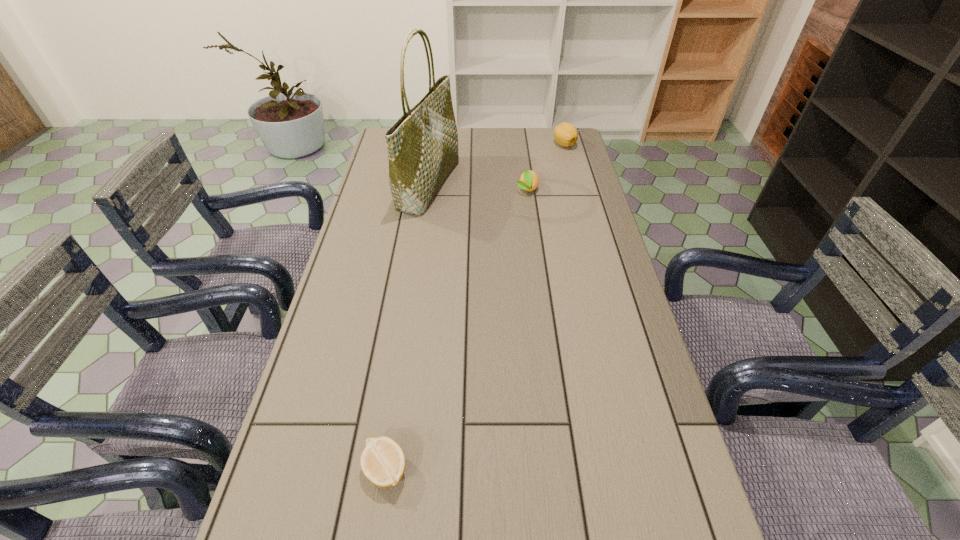
Where is `the third closest object to the leftmost lemon`? This screenshot has height=540, width=960. the third closest object to the leftmost lemon is located at coordinates (565, 134).

Identify which object is the third nearest to the shortest lemon. Please provide its 2D coordinates. Your answer should be formatted as a tuple, i.e. [(x, y)], where the tuple contains the x and y coordinates of a point satisfying the conditions above.

[(565, 134)]

At what (x,y) coordinates should I click in order to perform the action: click on lemon object that ranks as the closest to the rightmost lemon. Please return your answer as a coordinate pair (x, y). The image size is (960, 540). Looking at the image, I should click on (529, 181).

What are the coordinates of `the second closest lemon to the farthest lemon` in the screenshot? It's located at (382, 461).

Image resolution: width=960 pixels, height=540 pixels. Find the location of `free point that satisfies the following two spatial constraints: 1. on the back side of the shopping bag; 2. on the left side of the nearest lemon`. free point that satisfies the following two spatial constraints: 1. on the back side of the shopping bag; 2. on the left side of the nearest lemon is located at coordinates (428, 185).